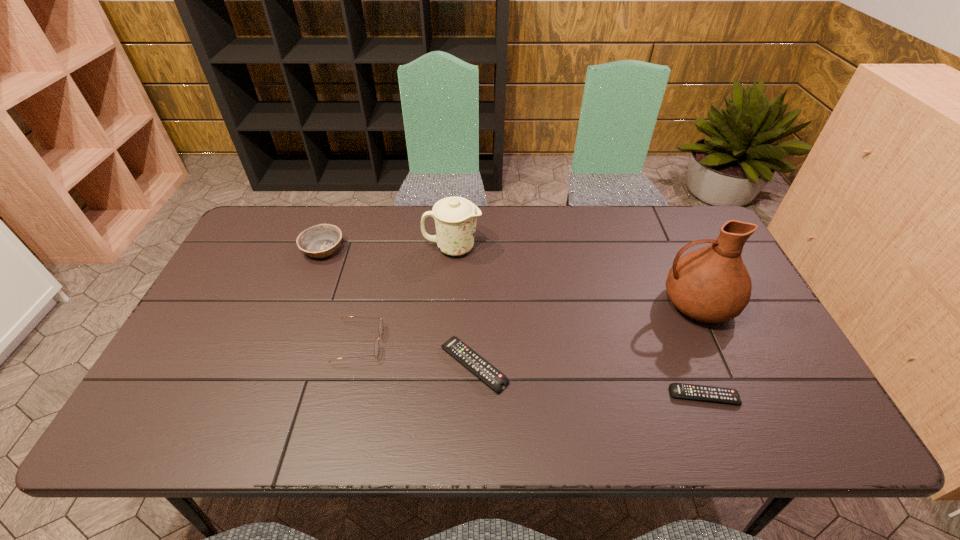
The height and width of the screenshot is (540, 960). I want to click on vacant space located 0.170m on the right of the bowl, so click(398, 249).

Identify the location of vacant region located on the temples of the second object from left to right. (530, 343).

Identify the location of vacant space located on the spout of the chinaware. Image resolution: width=960 pixels, height=540 pixels. (579, 248).

Find the location of a particular element. The image size is (960, 540). free space located 0.300m on the side of the tallest object with the handle is located at coordinates (549, 304).

The image size is (960, 540). In order to click on free point located on the side of the tallest object with the handle in this screenshot , I will do `click(524, 304)`.

Locate an element on the screen. vacant space located on the side of the tallest object with the handle is located at coordinates (517, 304).

This screenshot has width=960, height=540. Find the location of `bowl that is at the far edge`. bowl that is at the far edge is located at coordinates (320, 241).

You are a GUI agent. You are given a task and a screenshot of the screen. Output one action in this format:
    pyautogui.click(x=<x>, y=<y>)
    Task: Click on the chinaware located at the far edge
    This screenshot has width=960, height=540.
    Given the screenshot: What is the action you would take?
    pyautogui.click(x=455, y=218)

Image resolution: width=960 pixels, height=540 pixels. In order to click on remote control that is at the right edge in this screenshot , I will do `click(679, 390)`.

You are a GUI agent. You are given a task and a screenshot of the screen. Output one action in this format:
    pyautogui.click(x=<x>, y=<y>)
    Task: Click on the pitcher at the right edge
    The height and width of the screenshot is (540, 960).
    Given the screenshot: What is the action you would take?
    pyautogui.click(x=711, y=284)